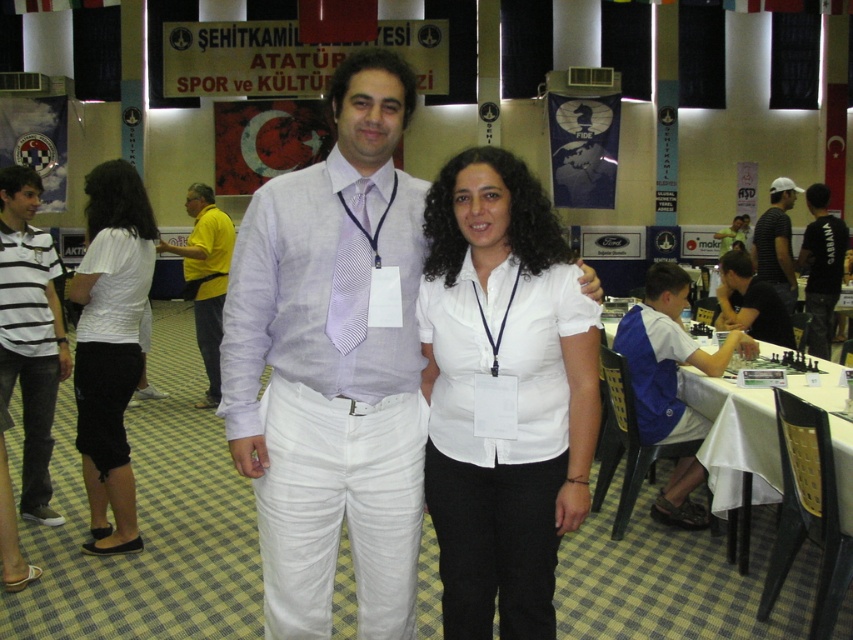
You are standing in the conference hall and want to reach the point at coordinates point (848, 493). If your walking distance is limited to 8 feet, can you reach that point without moving further away?

The distance between you and point (848, 493) is 8.62 feet, which exceeds your 8 feet limit. Therefore, you cannot reach it without exceeding your walking distance limit.

You are organizing a formal event and need to ensure that all participants have properly sized accessories. You notice the lavender striped tie at center and the dark blue shirt at center. Which accessory has a narrower width?

The lavender striped tie at center has a lesser width compared to the dark blue shirt at center.